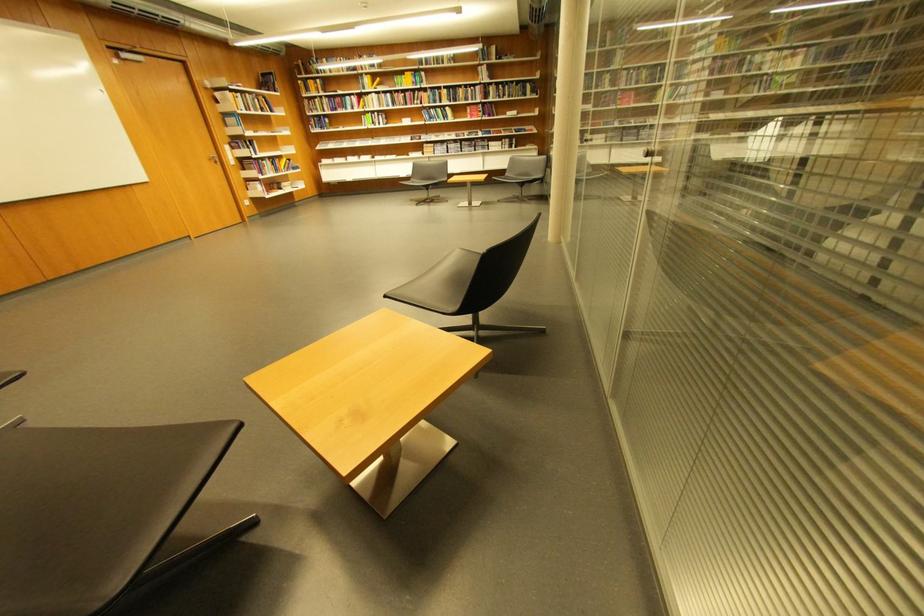
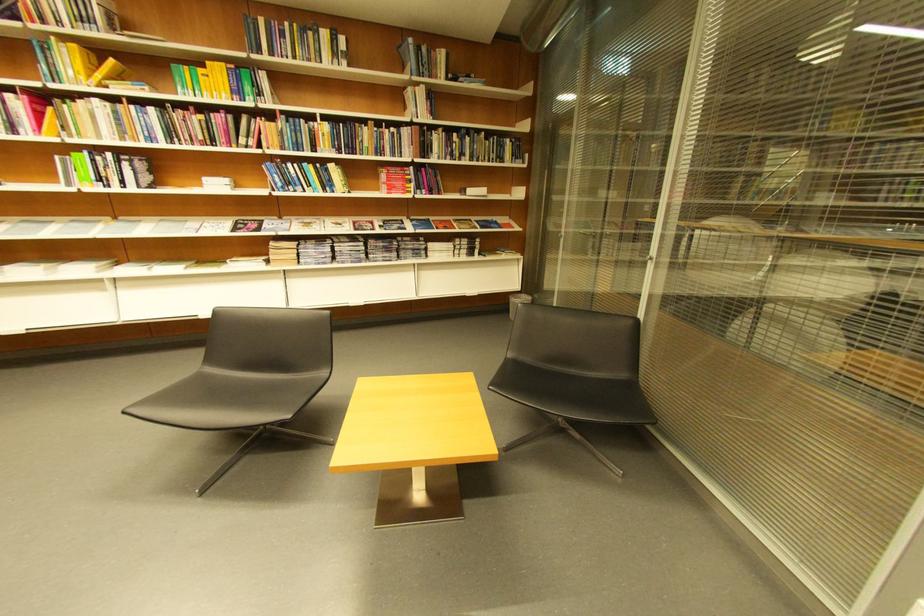
The point at (439, 121) is marked in the first image. Where is the corresponding point in the second image?

(290, 185)